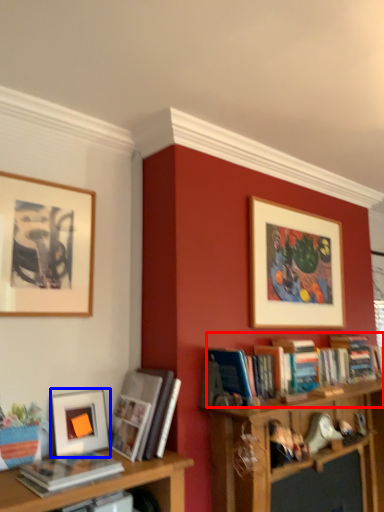
Question: Which object is closer to the camera taking this photo, book (highlighted by a red box) or picture frame (highlighted by a blue box)?

Choices:
 (A) book
 (B) picture frame

Answer: (B)